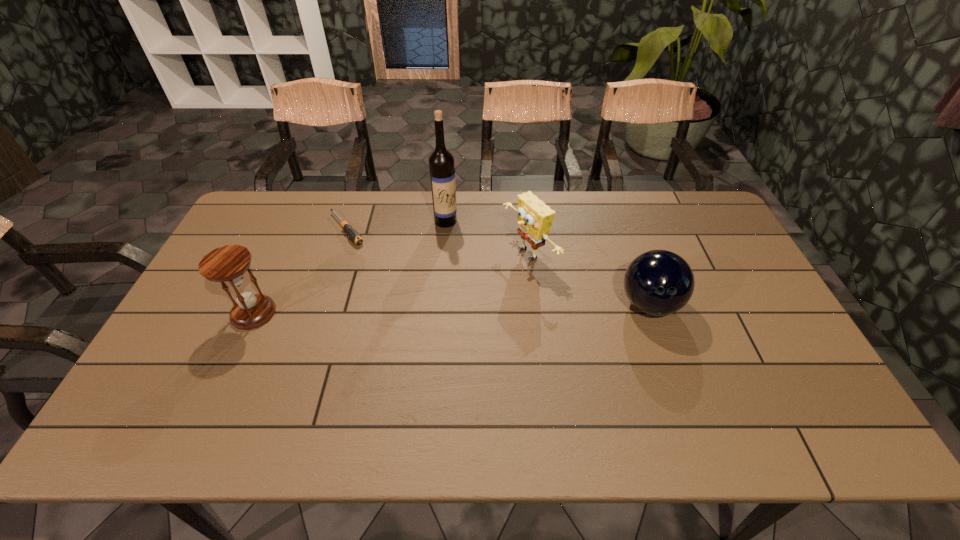
Identify the location of object that can be found as the third closest to the fourth object from left to right. (352, 233).